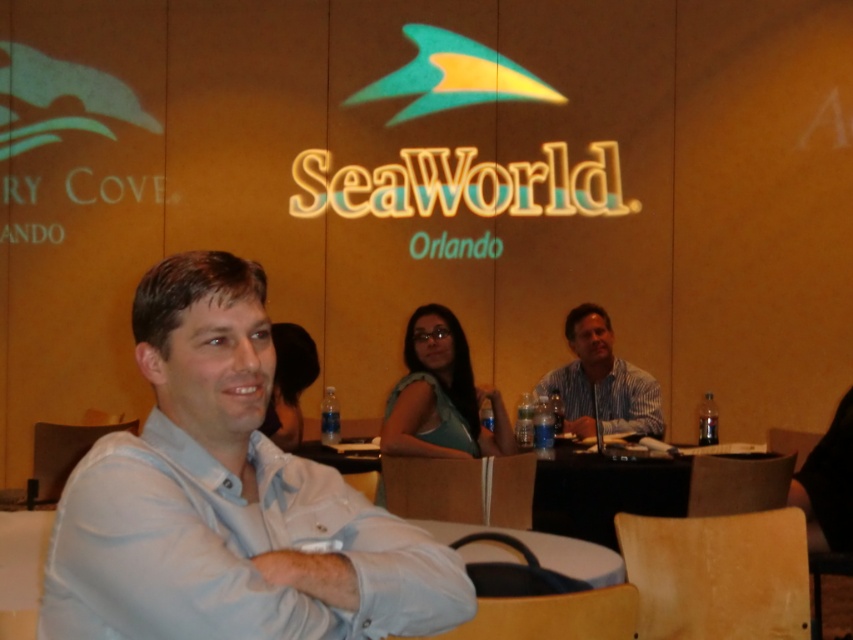
You are standing in the conference room shown in the image. There are two points marked in the scene. Which of these two points, point (546, 547) or point (653, 385), is closer to you?

Point (546, 547) is closer to the camera than point (653, 385).